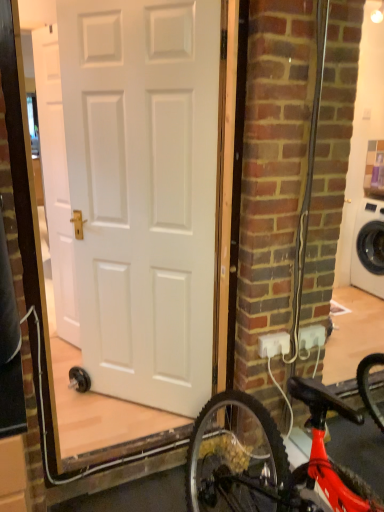
Question: From their relative heights in the image, would you say shiny red bicycle at lower right is taller or shorter than white matte door at center, the second door in the left-to-right sequence?

Choices:
 (A) tall
 (B) short

Answer: (B)

Question: Considering the positions of point (271, 482) and point (195, 220), is point (271, 482) closer or farther from the camera than point (195, 220)?

Choices:
 (A) closer
 (B) farther

Answer: (A)

Question: Considering the real-world distances, which object is farthest from the white matte door at upper left, which ranks as the 1th door in left-to-right order?

Choices:
 (A) shiny red bicycle at lower right
 (B) white matte door at center, the first door positioned from the front
 (C) white plastic outlet at lower right

Answer: (C)

Question: Which is nearer to the white plastic outlet at lower right?

Choices:
 (A) white matte door at center, the first door positioned from the front
 (B) shiny red bicycle at lower right
 (C) white matte door at upper left, which ranks as the 1th door in left-to-right order

Answer: (B)